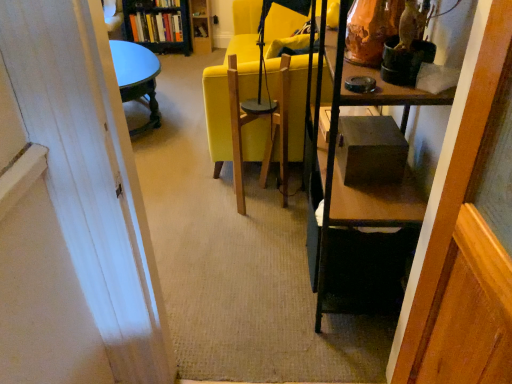
Question: Is hardcover books at upper left, which is the second book in top-to-bottom order, oriented towards wooden swivel chair at center?

Choices:
 (A) no
 (B) yes

Answer: (B)

Question: From the image's perspective, is hardcover books at upper left, which is the second book in top-to-bottom order, below wooden swivel chair at center?

Choices:
 (A) yes
 (B) no

Answer: (B)

Question: Can you confirm if hardcover books at upper left, the first book when ordered from bottom to top, is positioned to the left of wooden swivel chair at center?

Choices:
 (A) no
 (B) yes

Answer: (B)

Question: Can you confirm if hardcover books at upper left, the first book when ordered from bottom to top, is taller than wooden swivel chair at center?

Choices:
 (A) no
 (B) yes

Answer: (A)

Question: Is hardcover books at upper left, which is the second book in top-to-bottom order, positioned far away from wooden swivel chair at center?

Choices:
 (A) no
 (B) yes

Answer: (B)

Question: Based on their sizes in the image, would you say wooden swivel chair at center is bigger or smaller than matte yellow chair at center?

Choices:
 (A) small
 (B) big

Answer: (A)

Question: In the image, is wooden swivel chair at center positioned in front of or behind matte yellow chair at center?

Choices:
 (A) front
 (B) behind

Answer: (A)

Question: Is wooden swivel chair at center inside the boundaries of matte yellow chair at center, or outside?

Choices:
 (A) outside
 (B) inside

Answer: (A)

Question: Is wooden swivel chair at center wider or thinner than matte yellow chair at center?

Choices:
 (A) wide
 (B) thin

Answer: (B)

Question: In terms of width, does matte yellow chair at center look wider or thinner when compared to hardcover book at upper center, the 1th book from the top?

Choices:
 (A) thin
 (B) wide

Answer: (B)

Question: Is matte yellow chair at center inside the boundaries of hardcover book at upper center, arranged as the second book when ordered from the bottom, or outside?

Choices:
 (A) inside
 (B) outside

Answer: (B)

Question: Is matte yellow chair at center taller or shorter than hardcover book at upper center, the 1th book from the top?

Choices:
 (A) tall
 (B) short

Answer: (A)

Question: In the image, is matte yellow chair at center positioned in front of or behind hardcover book at upper center, arranged as the second book when ordered from the bottom?

Choices:
 (A) behind
 (B) front

Answer: (B)

Question: Considering the positions of point (137, 19) and point (266, 137), is point (137, 19) closer or farther from the camera than point (266, 137)?

Choices:
 (A) farther
 (B) closer

Answer: (A)

Question: From the image's perspective, is hardcover books at upper left, which is the second book in top-to-bottom order, positioned above or below wooden swivel chair at center?

Choices:
 (A) below
 (B) above

Answer: (B)